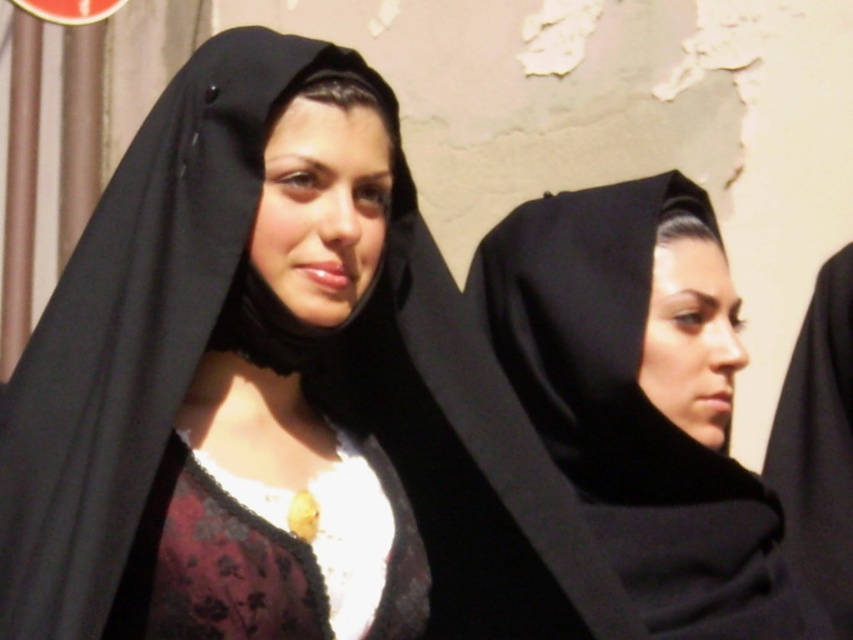
Can you confirm if matte black headscarf at center is bigger than black matte robe at right?

Indeed, matte black headscarf at center has a larger size compared to black matte robe at right.

Can you confirm if matte black headscarf at center is positioned to the left of black matte robe at right?

Correct, you'll find matte black headscarf at center to the left of black matte robe at right.

Who is more distant from viewer, (74, 609) or (840, 253)?

The point (840, 253) is behind.

This screenshot has height=640, width=853. Find the location of `matte black headscarf at center`. matte black headscarf at center is located at coordinates (132, 326).

Is point (154, 172) farther from viewer compared to point (392, 538)?

No, (154, 172) is closer to viewer.

Which of these two, matte black headscarf at center or velvet-like burgundy dress at center, stands shorter?

velvet-like burgundy dress at center is shorter.

Measure the distance between matte black headscarf at center and camera.

matte black headscarf at center and camera are 7.22 feet apart from each other.

I want to click on matte black headscarf at center, so click(x=132, y=326).

Based on the photo, is black velvet headscarf at center positioned in front of black matte robe at right?

Yes.

At what (x,y) coordinates should I click in order to perform the action: click on black velvet headscarf at center. Please return your answer as a coordinate pair (x, y). This screenshot has height=640, width=853. Looking at the image, I should click on (631, 413).